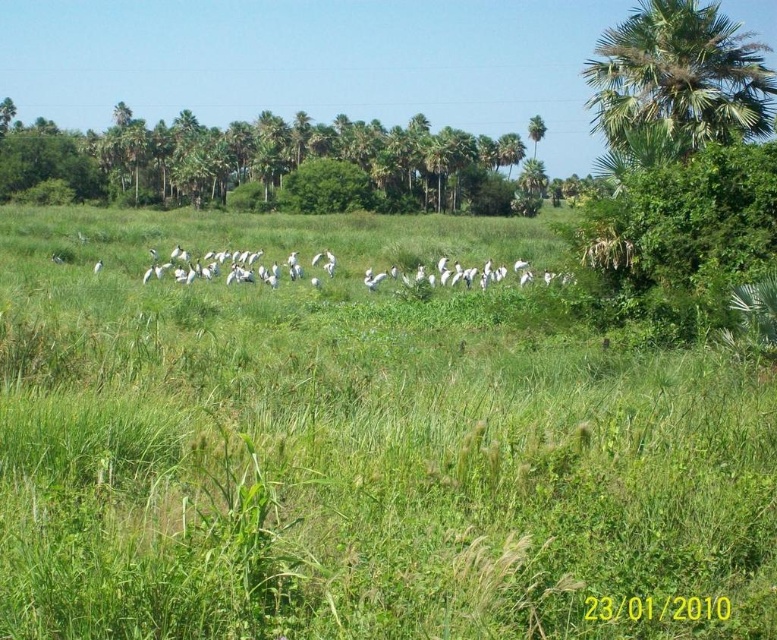
You are an ornithologist observing the scene. You notice the green leafy trees at upper left and the green leafy palm tree at upper right. Which of these two trees is positioned more to the left in the image?

The green leafy trees at upper left are positioned more to the left than the green leafy palm tree at upper right.

You are a birdwatcher observing the scene. You notice the green grassy at center and the green leafy palm tree at upper right. Which object is located to the right of the other?

The green leafy palm tree at upper right is positioned to the right of the green grassy at center.